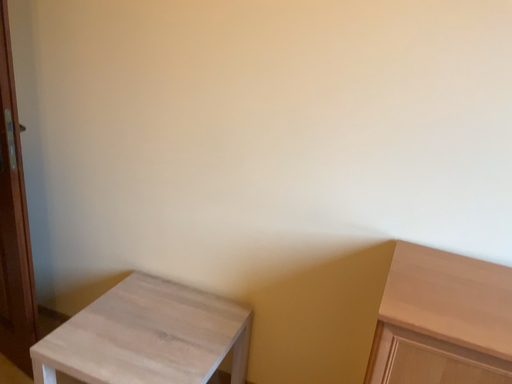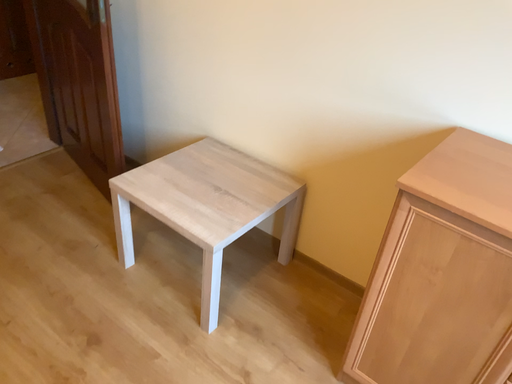
Question: Which way did the camera rotate in the video?

Choices:
 (A) rotated right
 (B) rotated left

Answer: (B)